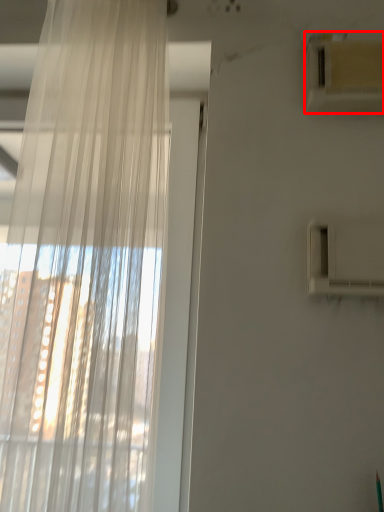
Question: From the image's perspective, what is the correct spatial relationship of air conditioning (annotated by the red box) in relation to curtain?

Choices:
 (A) above
 (B) below

Answer: (A)